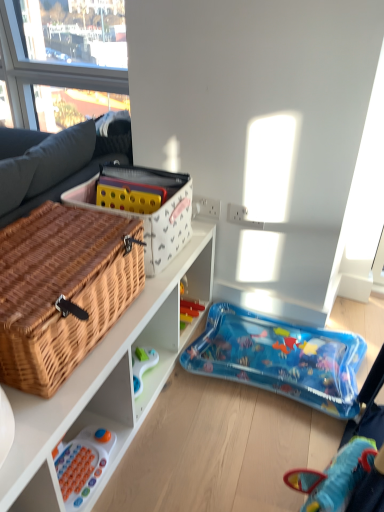
Question: Is woven brown picnic basket at left inside or outside of white fabric storage box at upper center?

Choices:
 (A) outside
 (B) inside

Answer: (A)

Question: From a real-world perspective, relative to white fabric storage box at upper center, is woven brown picnic basket at left vertically above or below?

Choices:
 (A) above
 (B) below

Answer: (B)

Question: Which object is the farthest from the woven wood cabinet at lower left?

Choices:
 (A) white fabric storage box at upper center
 (B) blue inflatable pool at lower right, which is the first toy in back-to-front order
 (C) white plastic toy at lower left, the 1th toy positioned from the bottom
 (D) woven brown picnic basket at left

Answer: (B)

Question: Based on their relative distances, which object is nearer to the blue inflatable pool at lower right, which is the 2th toy in bottom-to-top order?

Choices:
 (A) white plastic toy at lower left, which appears as the 2th toy when viewed from the right
 (B) woven brown picnic basket at left
 (C) white fabric storage box at upper center
 (D) woven wood cabinet at lower left

Answer: (D)